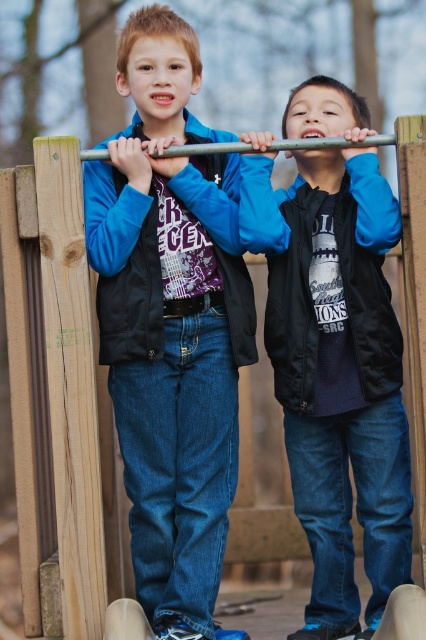
You are a photographer trying to capture a closeup of the black matte vest at center in the playground image. The vest is located at point (336, 369). The photographer wants to know if the vest is positioned exactly at the center of the image. Please check the coordinates and provide your answer.

The black matte vest at center is located at point (336, 369), which is very close to the center of the image. The coordinates indicate it is slightly to the right and lower than the exact center point of 0.5, 0.5. However, since the vest is labeled as being at the center in the description, it can be considered centrally positioned within the image frame.

You are a photographer trying to capture a clear shot of both the black matte vest at center and the black fabric jacket at upper center. Since they are both black, you need to adjust your camera settings to ensure both are visible. However, you notice that one is blocking part of the other. Which object is covering part of the other?

The black matte vest at center is in front of the black fabric jacket at upper center, so it is covering part of the jacket.

You are a photographer adjusting your camera to focus on the two boys in the image. You notice both have clothing items labeled as black matte vest at center and matte black jacket at center. Which clothing item is positioned lower on the boys?

The black matte vest at center is below the matte black jacket at center, so the vest is positioned lower.